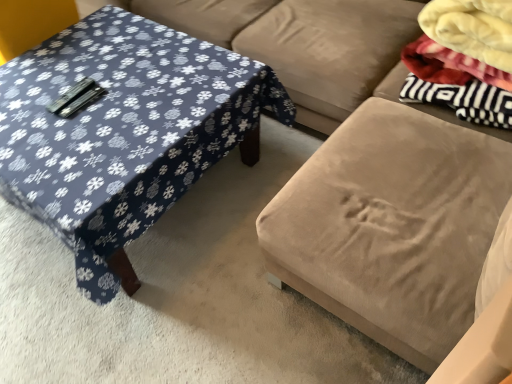
In order to click on empty space that is ontop of blue fabric-covered table at left in this screenshot , I will do `click(95, 108)`.